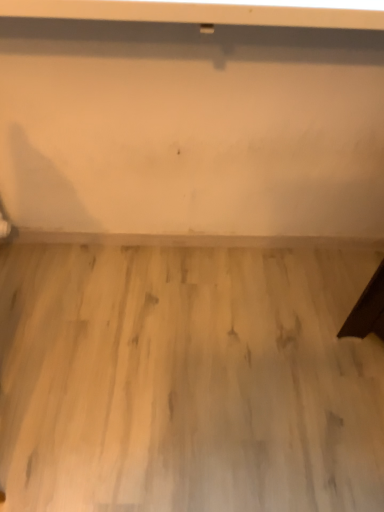
The width and height of the screenshot is (384, 512). Find the location of `free point above light wood plywood at center (from a real-world perspective)`. free point above light wood plywood at center (from a real-world perspective) is located at coordinates (196, 355).